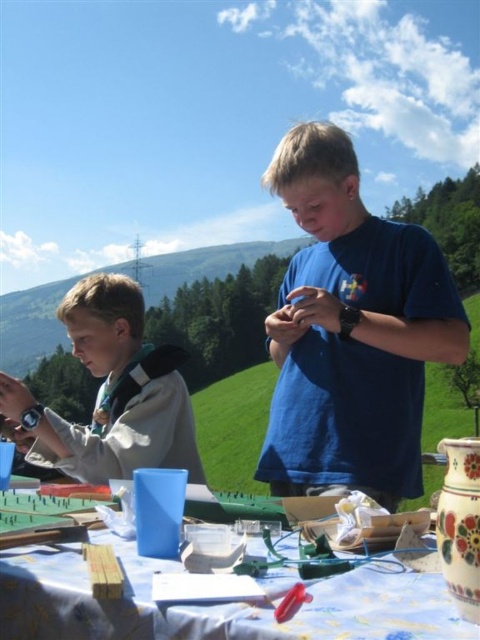
Question: Which point appears farthest from the camera in this image?

Choices:
 (A) (347, 154)
 (B) (136, 442)

Answer: (B)

Question: Among these points, which one is nearest to the camera?

Choices:
 (A) (433, 252)
 (B) (16, 579)

Answer: (B)

Question: Observing the image, what is the correct spatial positioning of blue matte shirt at center in reference to wooden blocks at lower left?

Choices:
 (A) above
 (B) below

Answer: (A)

Question: Which point appears farthest from the camera in this image?

Choices:
 (A) (158, 452)
 (B) (24, 577)

Answer: (A)

Question: In this image, where is blue matte shirt at center located relative to white fleece jacket at left?

Choices:
 (A) left
 (B) right

Answer: (B)

Question: Can you confirm if blue matte shirt at center is positioned to the right of wooden blocks at lower left?

Choices:
 (A) yes
 (B) no

Answer: (A)